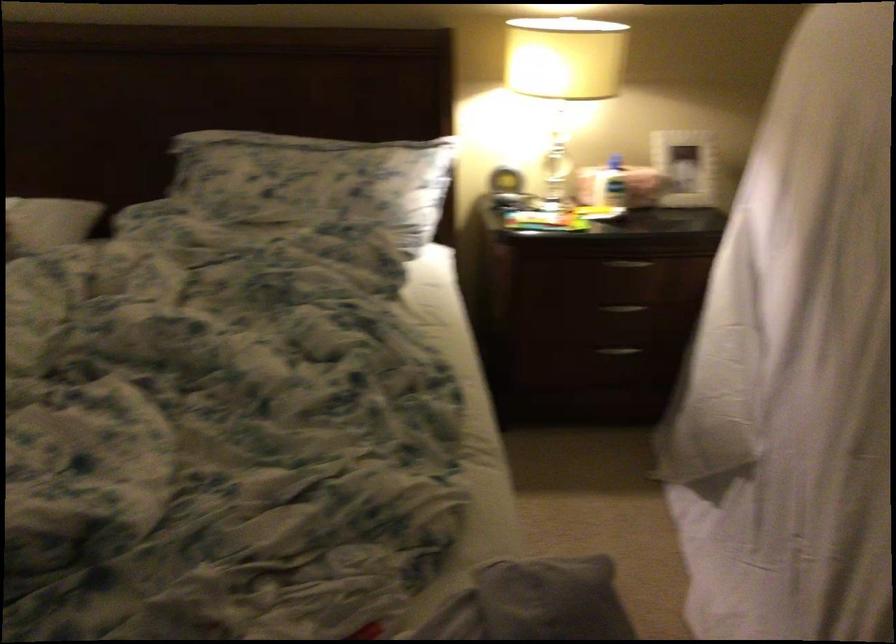
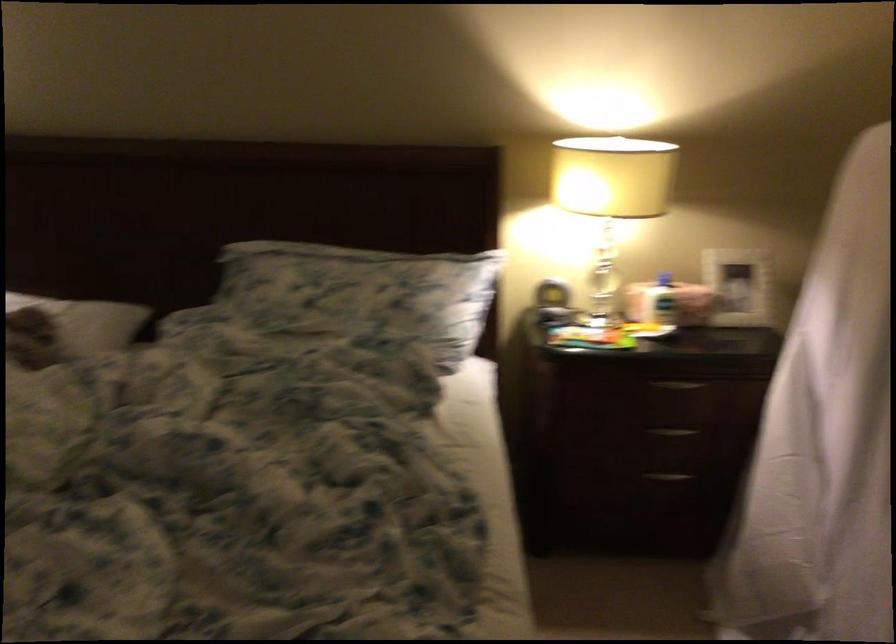
Find the pixel in the second image that matches pixel 629 261 in the first image.

(679, 384)